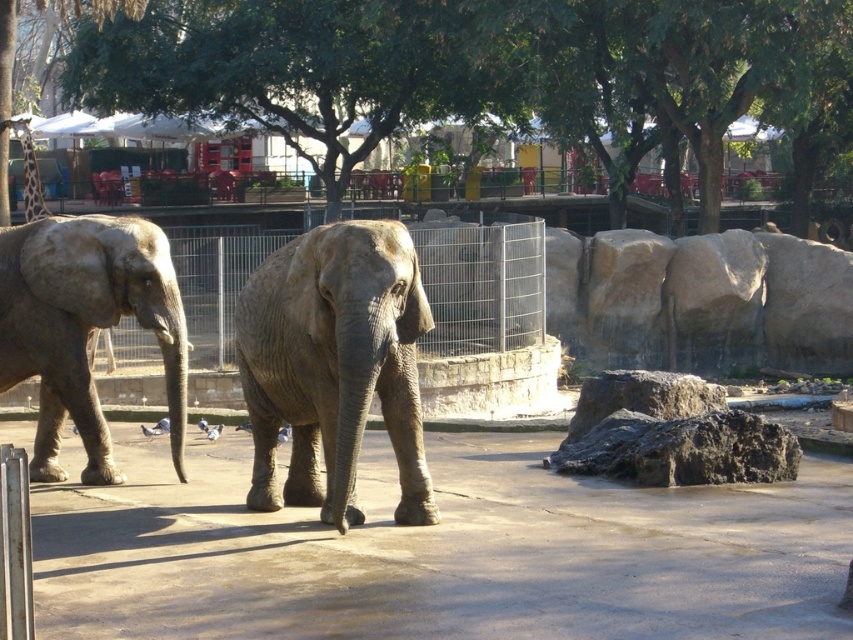
Question: Is gray matte elephant at center positioned in front of gray matte elephant at left?

Choices:
 (A) no
 (B) yes

Answer: (B)

Question: Does green leafy tree at upper center appear on the left side of gray matte elephant at left?

Choices:
 (A) yes
 (B) no

Answer: (A)

Question: Which point appears closest to the camera in this image?

Choices:
 (A) (323, 461)
 (B) (207, 278)
 (C) (161, 234)
 (D) (422, 1)

Answer: (A)

Question: Which point is farther from the camera taking this photo?

Choices:
 (A) (25, 371)
 (B) (183, 289)

Answer: (B)

Question: Based on their relative distances, which object is nearer to the gray matte elephant at left?

Choices:
 (A) green leafy tree at upper center
 (B) gray matte elephant at center
 (C) metal wire fence at center

Answer: (B)

Question: Is gray matte elephant at center above gray matte elephant at left?

Choices:
 (A) no
 (B) yes

Answer: (A)